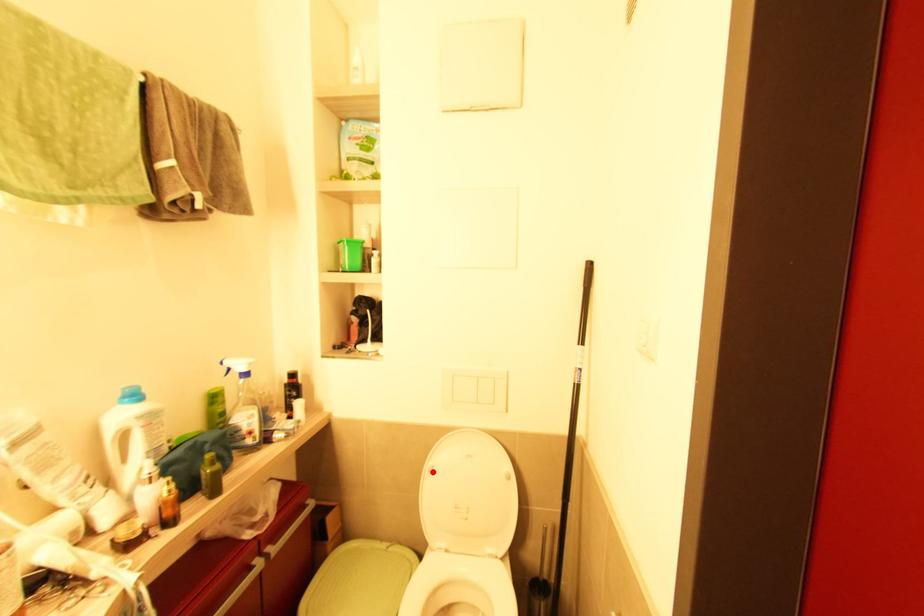
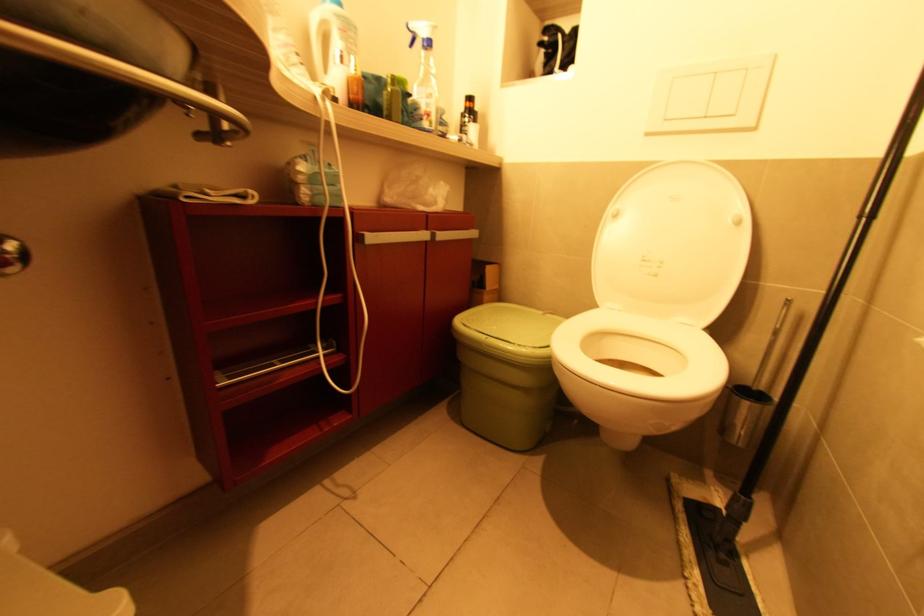
Question: I am providing you with two images of the same scene from different viewpoints. Image1 has a red point marked. In image2, the corresponding 3D location appears at what relative position? Reply with the corresponding letter.

Choices:
 (A) Closer
 (B) Farther

Answer: (A)